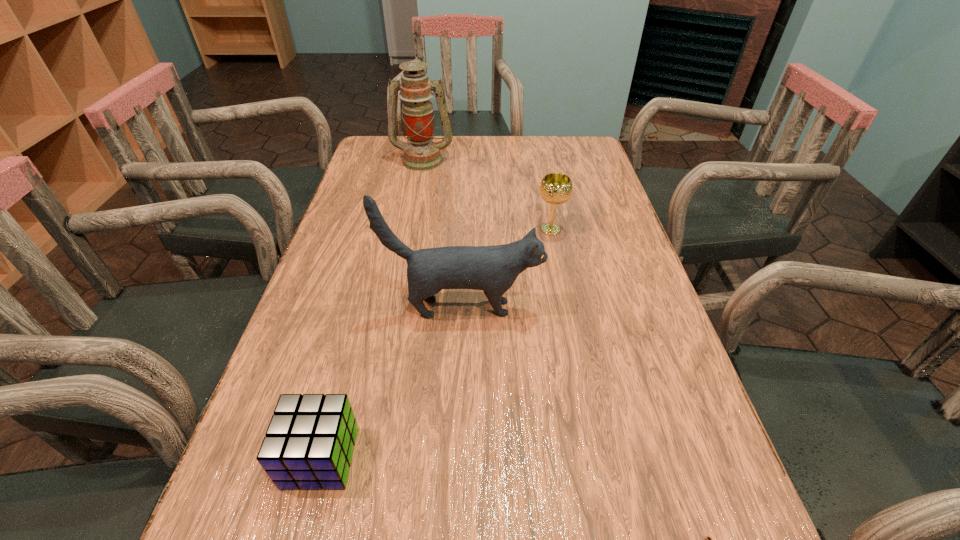
Image resolution: width=960 pixels, height=540 pixels. Find the location of `free space between the oil lamp and the second object from right to left`. free space between the oil lamp and the second object from right to left is located at coordinates (487, 195).

The image size is (960, 540). Find the location of `vacant point located between the second object from right to left and the oil lamp`. vacant point located between the second object from right to left and the oil lamp is located at coordinates (487, 195).

Where is `vacant area that lies between the third farthest object and the farthest object`? vacant area that lies between the third farthest object and the farthest object is located at coordinates (443, 234).

Where is `vacant space that is in between the third nearest object and the cube`? This screenshot has height=540, width=960. vacant space that is in between the third nearest object and the cube is located at coordinates (392, 382).

Locate which object is the closest to the third nearest object. Please provide its 2D coordinates. Your answer should be formatted as a tuple, i.e. [(x, y)], where the tuple contains the x and y coordinates of a point satisfying the conditions above.

[(555, 188)]

Select which object appears as the third closest to the rightmost object. Please provide its 2D coordinates. Your answer should be formatted as a tuple, i.e. [(x, y)], where the tuple contains the x and y coordinates of a point satisfying the conditions above.

[(555, 188)]